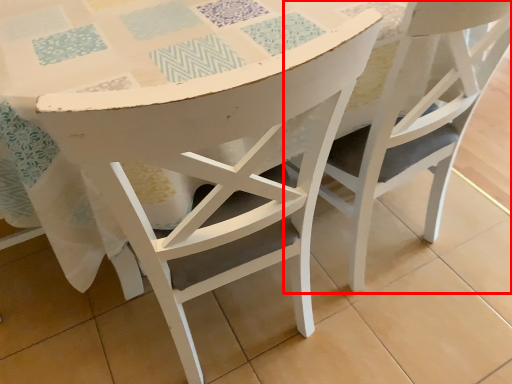
Question: Considering the relative positions of chair (annotated by the red box) and chair in the image provided, where is chair (annotated by the red box) located with respect to the staircase?

Choices:
 (A) right
 (B) left

Answer: (A)